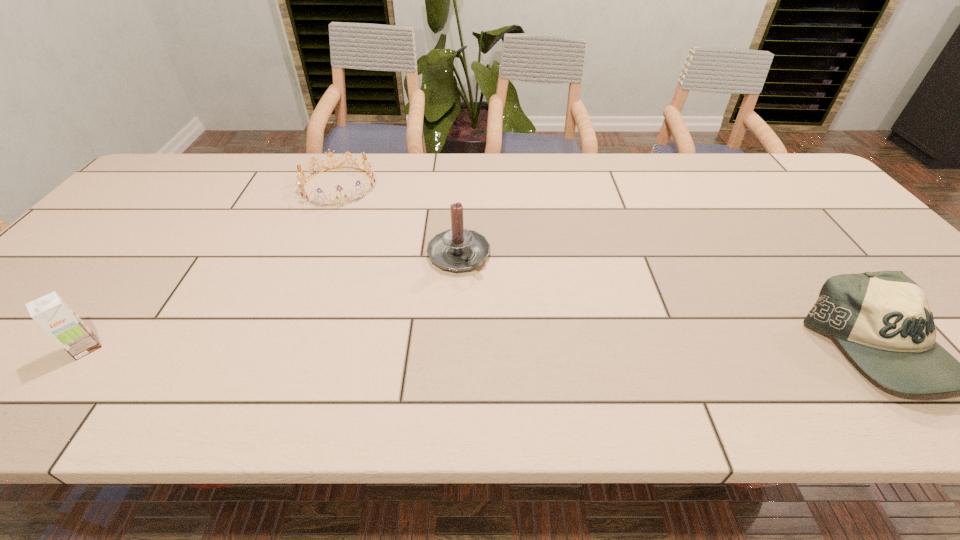
This screenshot has width=960, height=540. Identify the location of vacant area that lies between the chocolate milk and the farthest object. (212, 267).

Where is `free point between the second object from right to left and the leftmost object`? free point between the second object from right to left and the leftmost object is located at coordinates (273, 301).

Identify which object is the third closest to the candle. Please provide its 2D coordinates. Your answer should be formatted as a tuple, i.e. [(x, y)], where the tuple contains the x and y coordinates of a point satisfying the conditions above.

[(882, 320)]

The height and width of the screenshot is (540, 960). Find the location of `the second closest object relative to the second object from right to left`. the second closest object relative to the second object from right to left is located at coordinates (50, 311).

This screenshot has height=540, width=960. In order to click on vacant space that satisfies the following two spatial constraints: 1. on the back side of the candle; 2. on the right side of the chocolate milk in this screenshot , I will do (x=159, y=255).